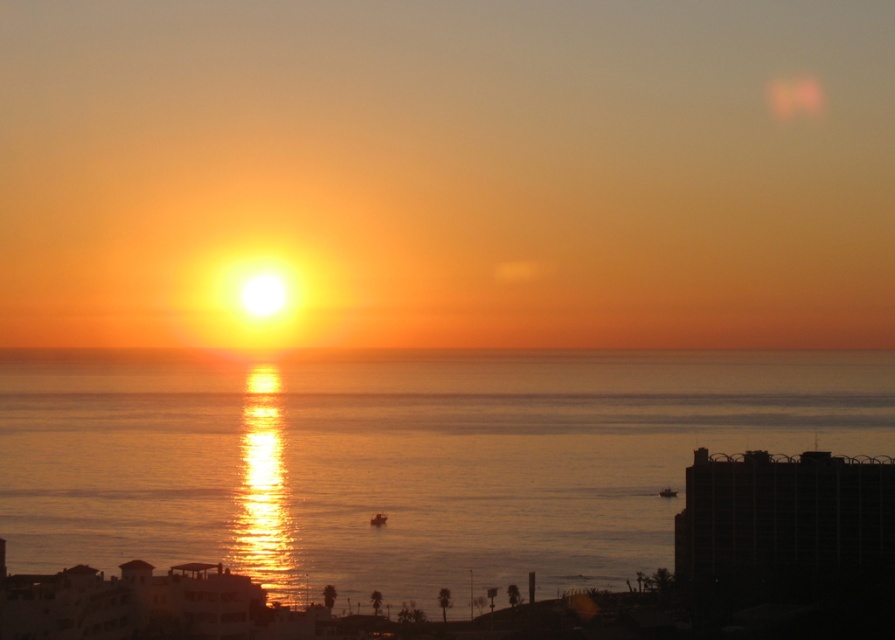
Between glistening water at center and orange matte horizon at center, which one appears on the left side from the viewer's perspective?

glistening water at center is more to the left.

Is glistening water at center smaller than orange matte horizon at center?

No, glistening water at center is not smaller than orange matte horizon at center.

Between point (482, 376) and point (774, 349), which one is positioned in front?

Point (482, 376) is in front.

Image resolution: width=895 pixels, height=640 pixels. Identify the location of glistening water at center. (399, 460).